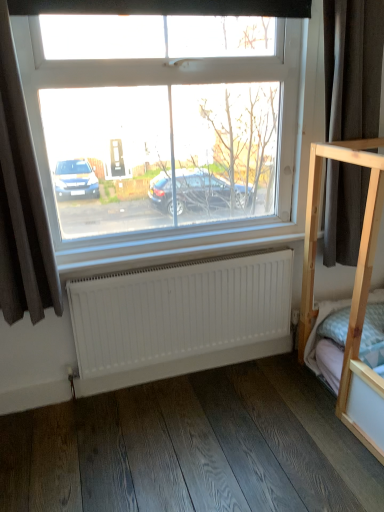
Where is `vacant space underneath brown fabric curtain at left, the 2th curtain viewed from the right (from a real-world perspective)`? vacant space underneath brown fabric curtain at left, the 2th curtain viewed from the right (from a real-world perspective) is located at coordinates pos(42,413).